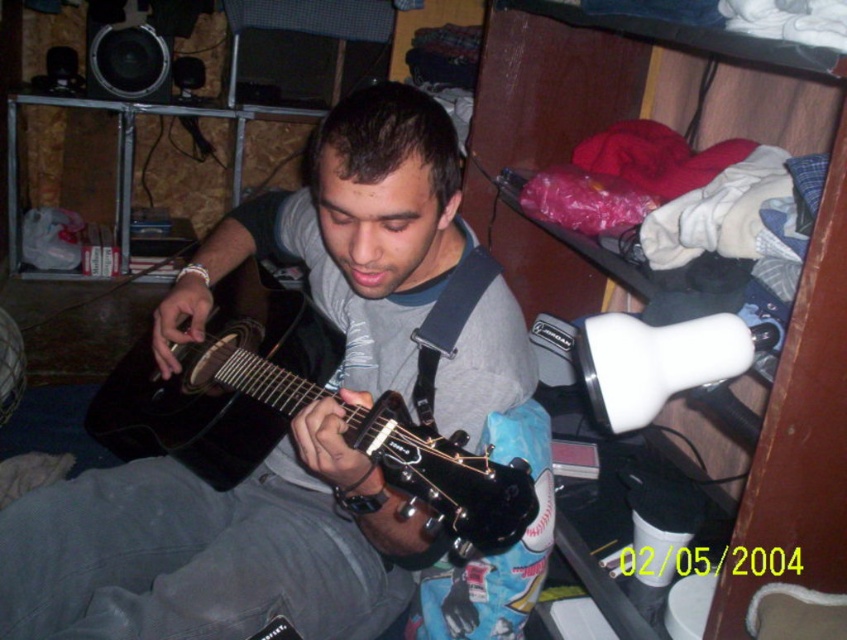
Is matte black guitar at center behind white plastic lamp at upper right?

Yes.

Who is taller, matte black guitar at center or white plastic lamp at upper right?

white plastic lamp at upper right

Is point (416, 413) farther from viewer compared to point (779, 426)?

Yes, point (416, 413) is behind point (779, 426).

You are a GUI agent. You are given a task and a screenshot of the screen. Output one action in this format:
    pyautogui.click(x=<x>, y=<y>)
    Task: Click on the matte black guitar at center
    
    Given the screenshot: What is the action you would take?
    pyautogui.click(x=216, y=547)

Measure the distance between matte black guitar at center and matte black acoustic guitar at center.

matte black guitar at center is 4.25 inches away from matte black acoustic guitar at center.

Which of these two, matte black guitar at center or matte black acoustic guitar at center, stands taller?

matte black guitar at center is taller.

Is point (286, 534) closer to camera compared to point (346, 433)?

No.

The image size is (847, 640). In order to click on matte black guitar at center in this screenshot , I will do `click(216, 547)`.

Describe the element at coordinates (606, 266) in the screenshot. This screenshot has width=847, height=640. I see `white plastic lamp at upper right` at that location.

Between point (618, 20) and point (446, 522), which one is positioned in front?

Positioned in front is point (446, 522).

Image resolution: width=847 pixels, height=640 pixels. Find the location of `white plastic lamp at upper right`. white plastic lamp at upper right is located at coordinates (606, 266).